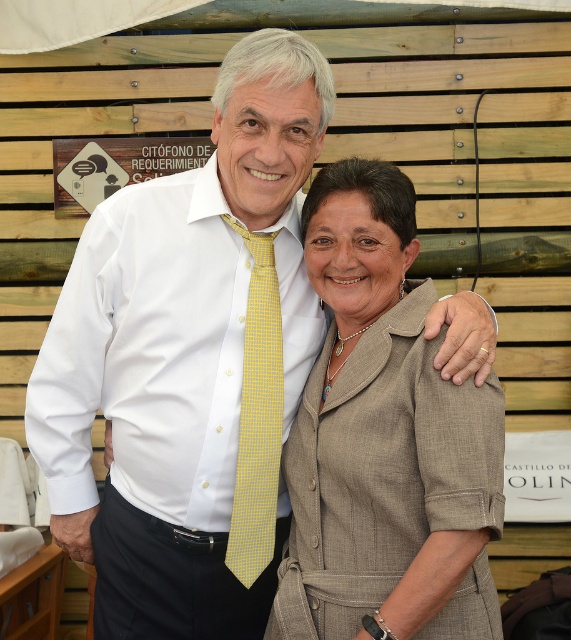
Question: In this image, where is matte beige suit at center located relative to yellow checkered tie at center?

Choices:
 (A) right
 (B) left

Answer: (A)

Question: Which object is closer to the camera taking this photo?

Choices:
 (A) yellow checkered tie at center
 (B) matte beige suit at center

Answer: (B)

Question: Does matte beige suit at center appear over yellow checkered tie at center?

Choices:
 (A) yes
 (B) no

Answer: (A)

Question: Which point is farther from the camera taking this photo?

Choices:
 (A) (263, 349)
 (B) (347, 179)

Answer: (A)

Question: Can you confirm if matte beige suit at center is bigger than yellow checkered tie at center?

Choices:
 (A) yes
 (B) no

Answer: (A)